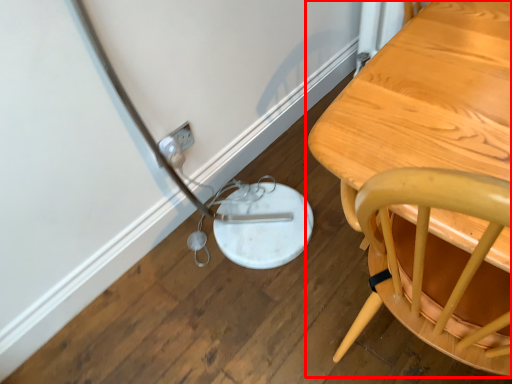
Question: From the image's perspective, where is table (annotated by the red box) located in relation to electric outlet in the image?

Choices:
 (A) above
 (B) below

Answer: (B)